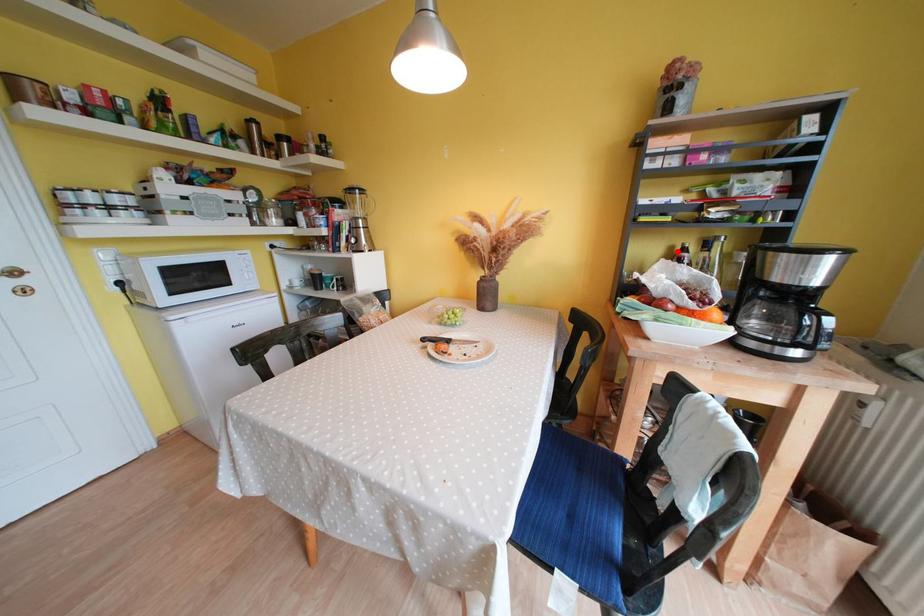
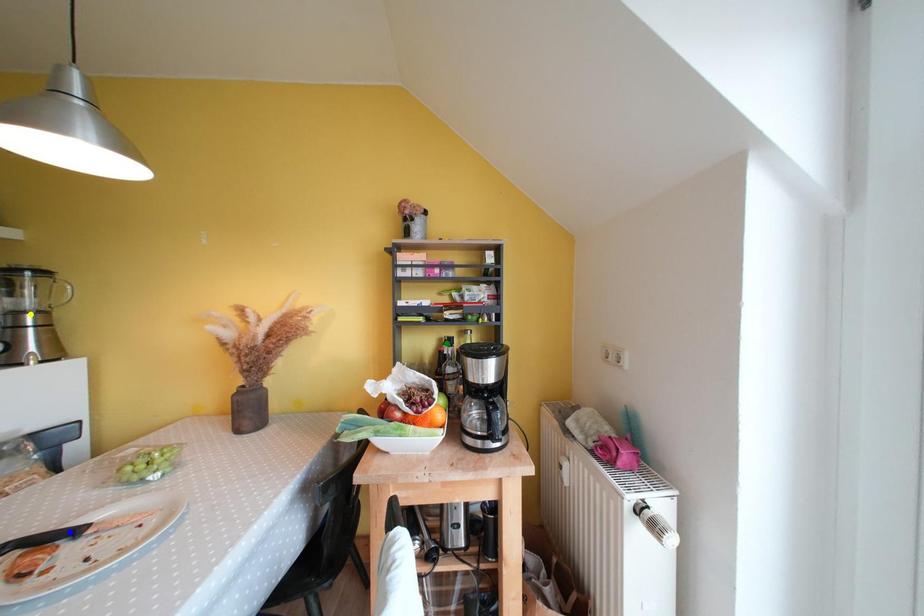
Question: I am providing you with two images of the same scene from different viewpoints. A red point is marked on the first image. You are given multiple points on the second image. Which spot in image 2 lines up with the point in image 1?

Choices:
 (A) green point
 (B) blue point
 (C) yellow point

Answer: (A)